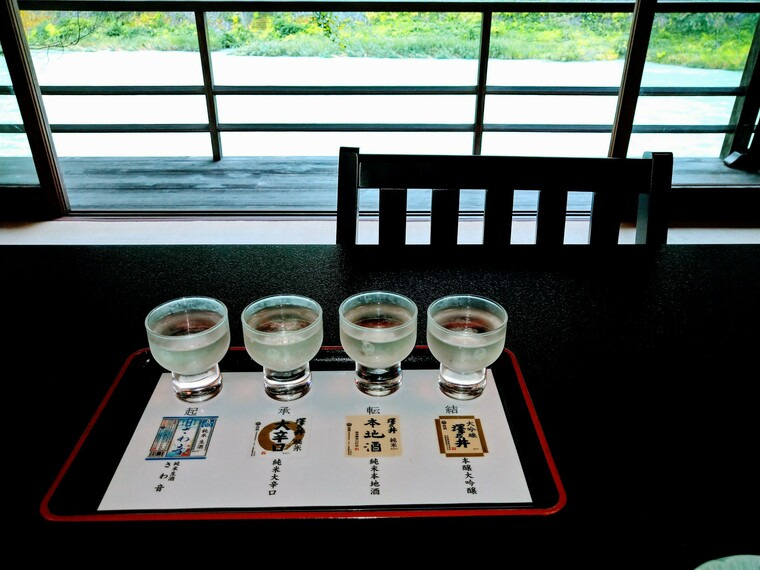
Find the location of a particular element. This screenshot has width=760, height=570. back rest of chair is located at coordinates (505, 180).